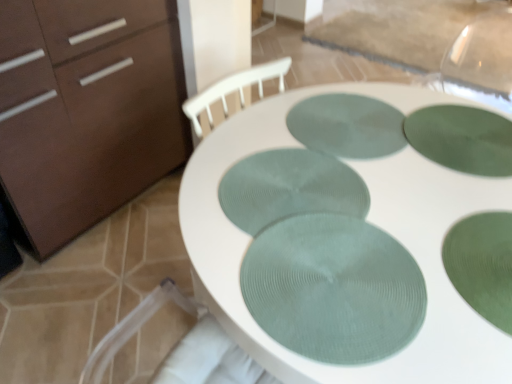
At what (x,y) coordinates should I click in order to perform the action: click on vacant area that lies to the right of green textured glass plate at center, placed as the fifth glass plate when sorted from back to front. Please return your answer as a coordinate pair (x, y). Looking at the image, I should click on (458, 264).